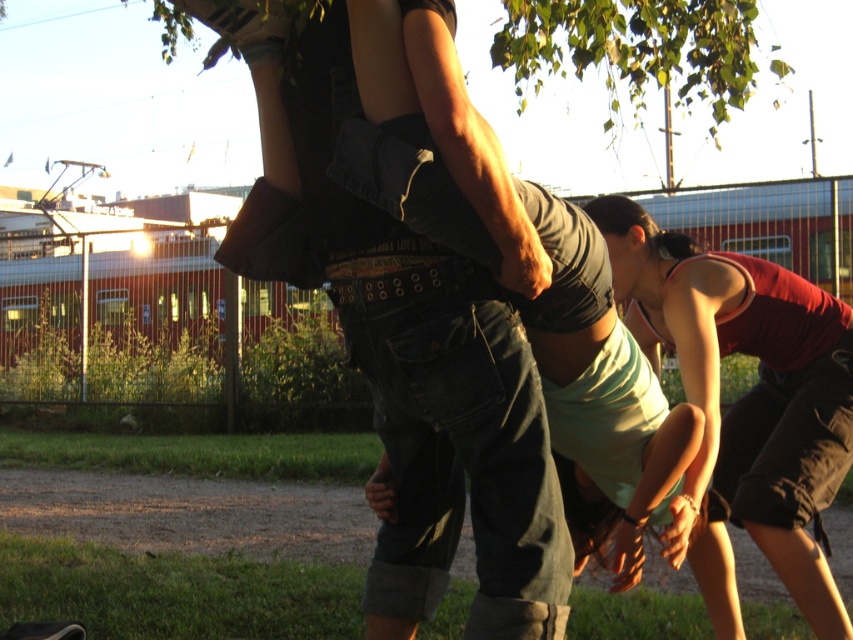
Question: Can you confirm if matte green tank top at lower right is wider than green leafy tree at upper center?

Choices:
 (A) yes
 (B) no

Answer: (B)

Question: Is denim jeans at center to the left of green leafy tree at upper center from the viewer's perspective?

Choices:
 (A) no
 (B) yes

Answer: (B)

Question: Does denim jeans at center have a larger size compared to green leafy tree at upper center?

Choices:
 (A) yes
 (B) no

Answer: (B)

Question: Which of these objects is positioned farthest from the green leafy tree at upper center?

Choices:
 (A) matte green tank top at lower right
 (B) denim jeans at center

Answer: (B)

Question: Among these points, which one is nearest to the camera?

Choices:
 (A) (521, 104)
 (B) (819, 614)

Answer: (B)

Question: Which object is closer to the camera taking this photo?

Choices:
 (A) matte green tank top at lower right
 (B) green leafy tree at upper center

Answer: (A)